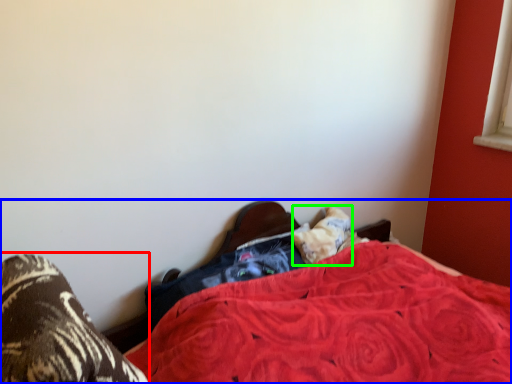
Question: Estimate the real-world distances between objects in this image. Which object is farther from footwear (highlighted by a red box), bed (highlighted by a blue box) or pillow (highlighted by a green box)?

Choices:
 (A) bed
 (B) pillow

Answer: (B)